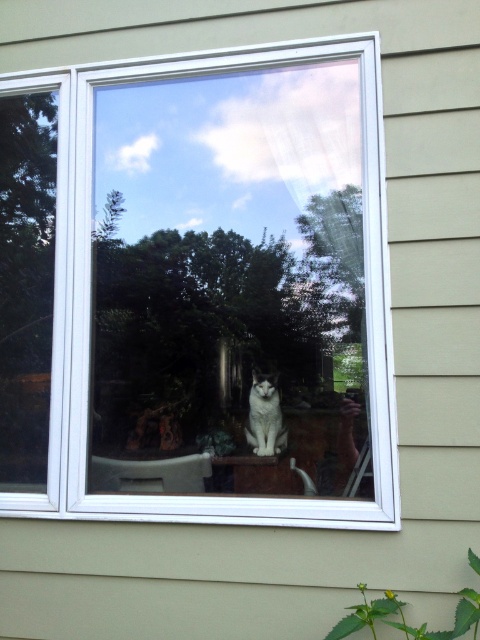
You are standing in a room and see the white plastic window at center and the white fur cat at center. Which object is located more to the left?

The white plastic window at center is positioned on the left side of the white fur cat at center, so it is more to the left.

What is the object located at the coordinates point (x=197, y=285) in the image?

The point (x=197, y=285) marks the white plastic window at center.